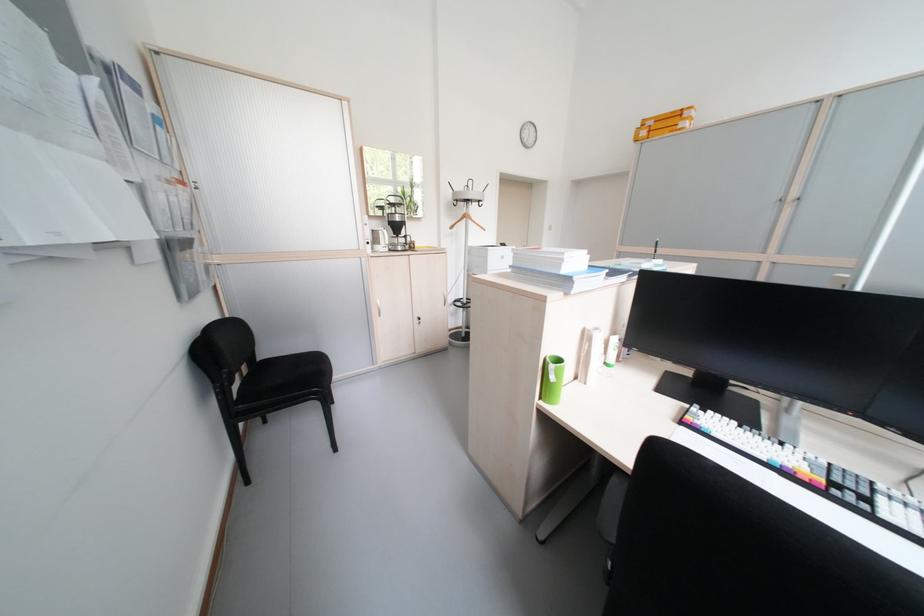
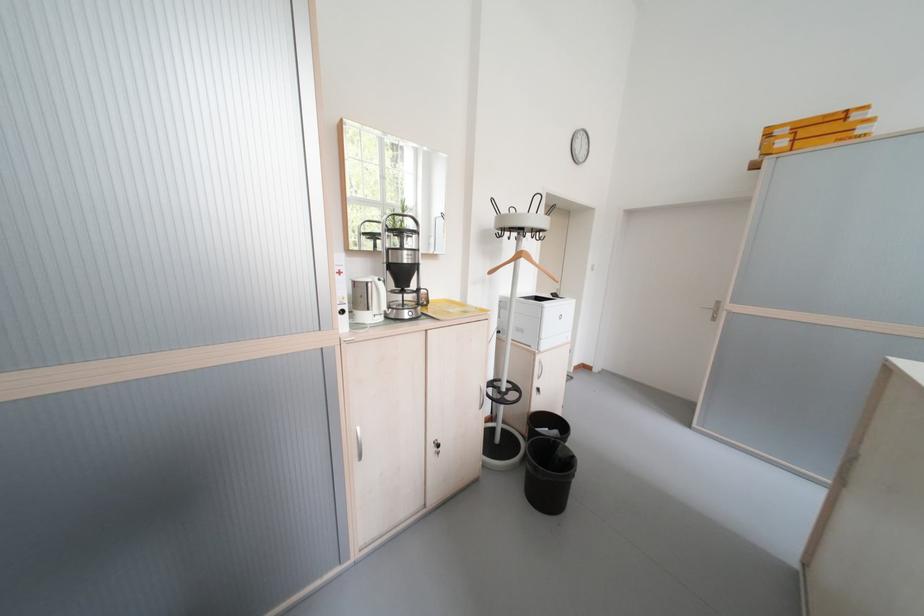
The point at (407,222) is marked in the first image. Where is the corresponding point in the second image?

(416, 262)